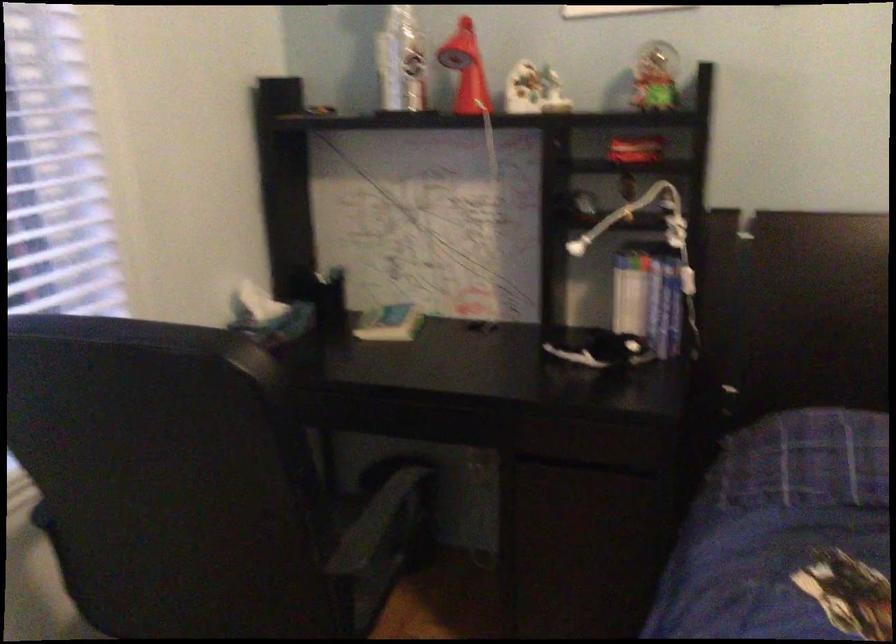
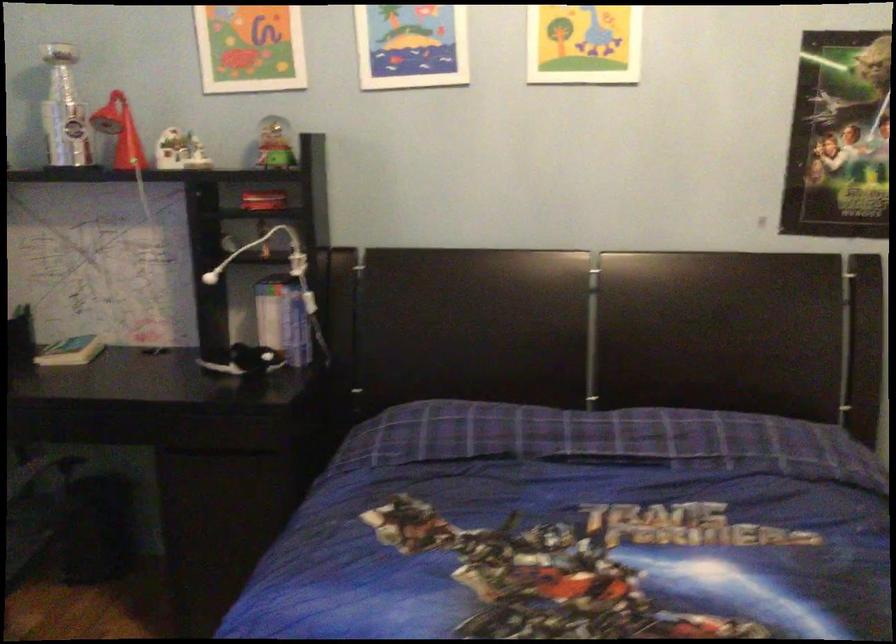
Where in the second image is the point corresponding to pixel 392 323 from the first image?

(71, 351)